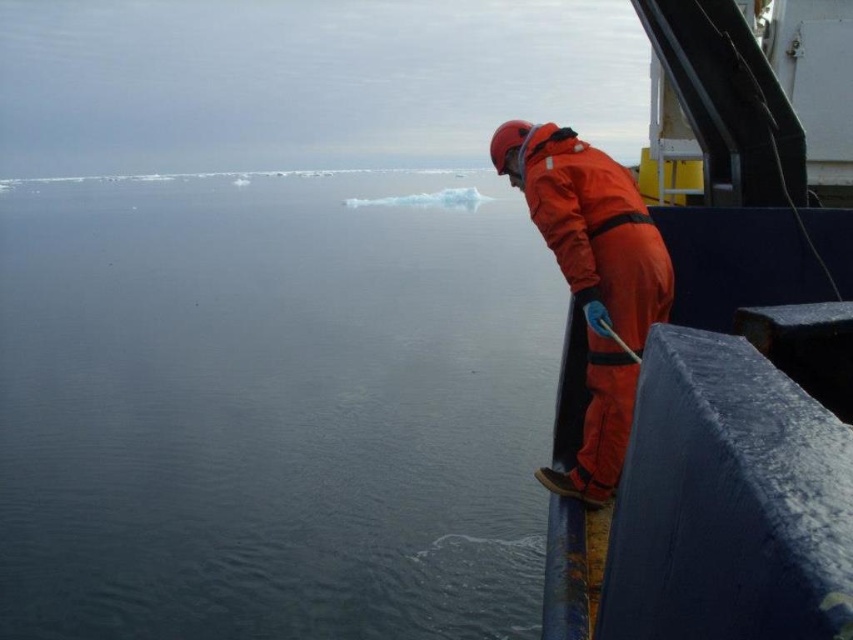
Question: Based on their relative distances, which object is nearer to the orange waterproof suit at right?

Choices:
 (A) orange fabric boat at right
 (B) dark blue water at center

Answer: (A)

Question: Estimate the real-world distances between objects in this image. Which object is closer to the dark blue water at center?

Choices:
 (A) orange fabric boat at right
 (B) orange waterproof suit at right

Answer: (B)

Question: Can you confirm if dark blue water at center is bigger than orange waterproof suit at right?

Choices:
 (A) yes
 (B) no

Answer: (A)

Question: Among these points, which one is nearest to the camera?

Choices:
 (A) (750, 200)
 (B) (289, 556)
 (C) (548, 220)

Answer: (C)

Question: Is dark blue water at center above orange fabric boat at right?

Choices:
 (A) yes
 (B) no

Answer: (A)

Question: Does dark blue water at center lie in front of orange fabric boat at right?

Choices:
 (A) no
 (B) yes

Answer: (A)